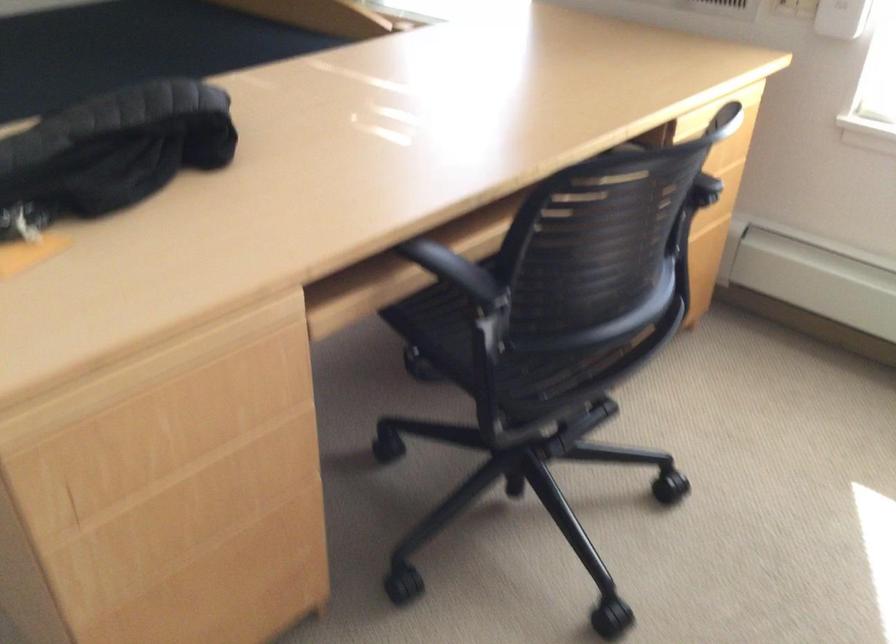
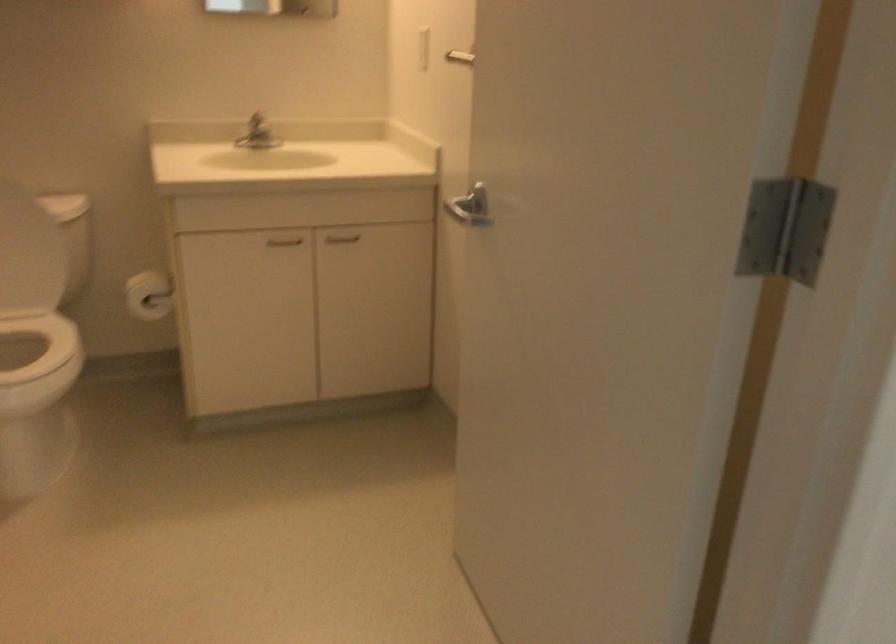
In a continuous first-person perspective shot, in which direction is the camera moving?

The cameraman moved toward left, backward.